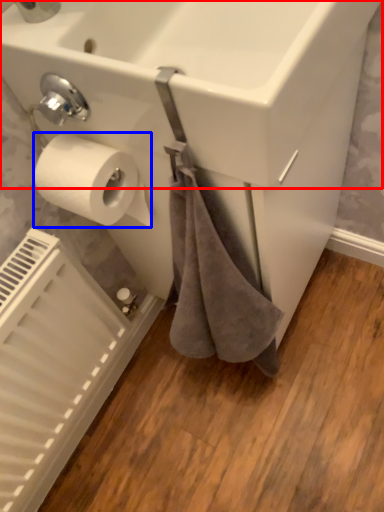
Question: Which object appears closest to the camera in this image, sink (highlighted by a red box) or toilet paper (highlighted by a blue box)?

Choices:
 (A) sink
 (B) toilet paper

Answer: (A)